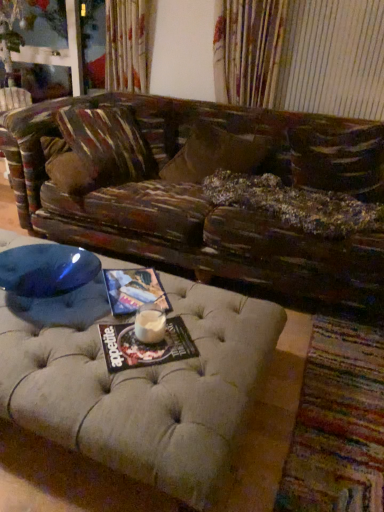
Question: Is white frothy liquid at center facing away from distressed wood studio couch at center?

Choices:
 (A) yes
 (B) no

Answer: (B)

Question: Are white frothy liquid at center and distressed wood studio couch at center making contact?

Choices:
 (A) yes
 (B) no

Answer: (B)

Question: Does white frothy liquid at center have a smaller size compared to distressed wood studio couch at center?

Choices:
 (A) yes
 (B) no

Answer: (A)

Question: Is white frothy liquid at center positioned far away from distressed wood studio couch at center?

Choices:
 (A) yes
 (B) no

Answer: (B)

Question: From a real-world perspective, is white frothy liquid at center below distressed wood studio couch at center?

Choices:
 (A) yes
 (B) no

Answer: (B)

Question: In terms of width, does multicolored woven mat at lower right look wider or thinner when compared to wooden swivel chair at left?

Choices:
 (A) thin
 (B) wide

Answer: (B)

Question: From the image's perspective, is multicolored woven mat at lower right above or below wooden swivel chair at left?

Choices:
 (A) above
 (B) below

Answer: (B)

Question: From a real-world perspective, is multicolored woven mat at lower right above or below wooden swivel chair at left?

Choices:
 (A) below
 (B) above

Answer: (A)

Question: Is multicolored woven mat at lower right taller or shorter than wooden swivel chair at left?

Choices:
 (A) short
 (B) tall

Answer: (A)

Question: In the image, is multicolored woven mat at lower right positioned in front of or behind matte paper magazine at center, the second magazine viewed from the top?

Choices:
 (A) front
 (B) behind

Answer: (A)

Question: Which is correct: multicolored woven mat at lower right is inside matte paper magazine at center, marked as the 1th magazine in a bottom-to-top arrangement, or outside of it?

Choices:
 (A) outside
 (B) inside

Answer: (A)

Question: Is point (329, 331) closer or farther from the camera than point (144, 350)?

Choices:
 (A) closer
 (B) farther

Answer: (B)

Question: From the image's perspective, is multicolored woven mat at lower right above or below matte paper magazine at center, which is the second magazine from back to front?

Choices:
 (A) above
 (B) below

Answer: (B)

Question: From the image's perspective, is distressed wood studio couch at center positioned above or below multicolored woven mat at lower right?

Choices:
 (A) below
 (B) above

Answer: (B)

Question: Visually, is distressed wood studio couch at center positioned to the left or to the right of multicolored woven mat at lower right?

Choices:
 (A) left
 (B) right

Answer: (A)